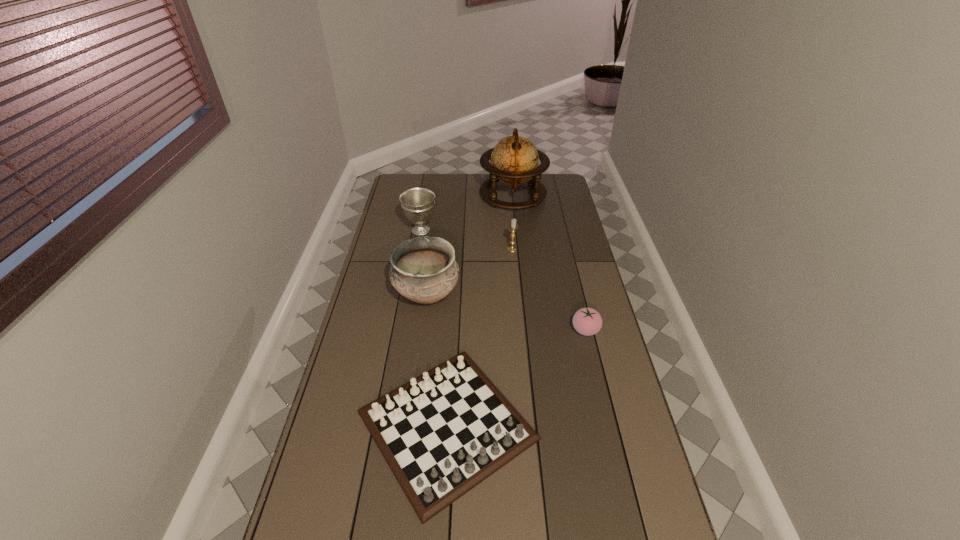
The image size is (960, 540). What are the coordinates of `free location located 0.060m on the right of the second farthest object` in the screenshot? It's located at (451, 230).

Locate an element on the screen. The image size is (960, 540). free location located on the right of the fourth nearest object is located at coordinates (547, 249).

Locate an element on the screen. free point located 0.060m on the left of the second shortest object is located at coordinates (554, 330).

Identify the location of vacant area located 0.090m on the left of the shortest object. This screenshot has width=960, height=540. (324, 425).

You are a GUI agent. You are given a task and a screenshot of the screen. Output one action in this format:
    pyautogui.click(x=<x>, y=<y>)
    Task: Click on the object located in the far edge section of the desktop
    Image resolution: width=960 pixels, height=540 pixels.
    Given the screenshot: What is the action you would take?
    pyautogui.click(x=514, y=160)

Where is `pottery at the left edge`? pottery at the left edge is located at coordinates (423, 269).

Image resolution: width=960 pixels, height=540 pixels. In order to click on chalice present at the left edge in this screenshot , I will do [418, 203].

Identify the location of chessboard that is at the left edge. (442, 433).

Image resolution: width=960 pixels, height=540 pixels. What are the coordinates of `globe at the right edge` in the screenshot? It's located at (514, 160).

The image size is (960, 540). What are the coordinates of `tomato at the right edge` in the screenshot? It's located at (587, 321).